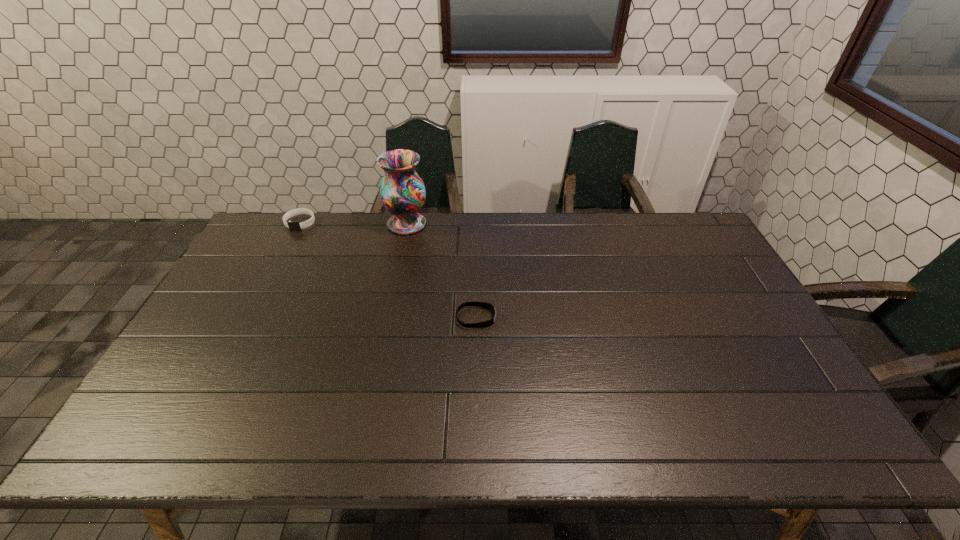
Find the location of a particular element. The height and width of the screenshot is (540, 960). object identified as the second closest to the tallest object is located at coordinates tap(485, 305).

Identify the location of free region that satisfies the following two spatial constraints: 1. on the outer surface of the farther wristband; 2. on the right side of the tallest object. The width and height of the screenshot is (960, 540). (300, 224).

Find the location of `blank area in the image that satisfies the following two spatial constraints: 1. on the outer surface of the vase; 2. on the left side of the leftmost object`. blank area in the image that satisfies the following two spatial constraints: 1. on the outer surface of the vase; 2. on the left side of the leftmost object is located at coordinates point(300,224).

The height and width of the screenshot is (540, 960). In order to click on free space in the image that satisfies the following two spatial constraints: 1. on the outer surface of the vase; 2. on the left side of the left wristband in this screenshot , I will do `click(300, 224)`.